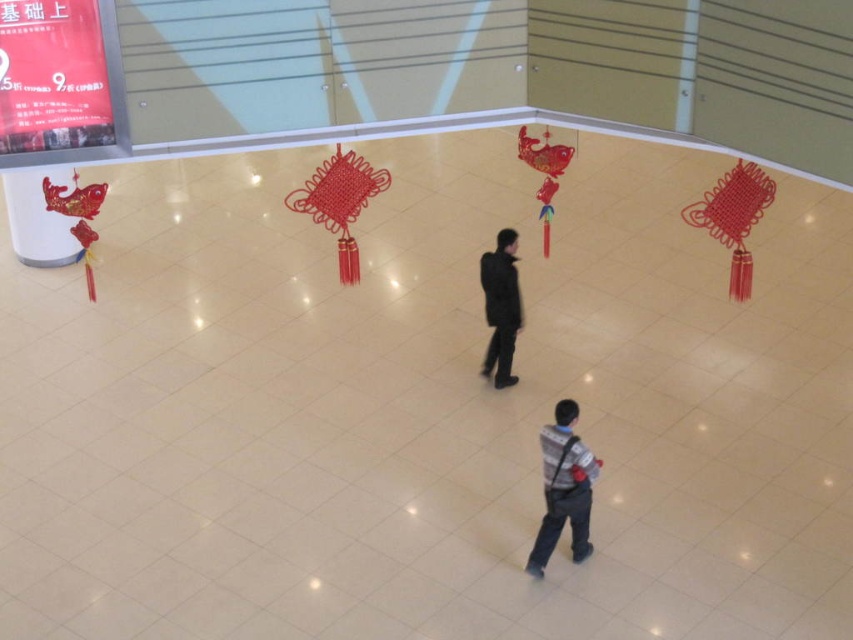
Question: Which point is closer to the camera?

Choices:
 (A) black matte jacket at center
 (B) striped sweater at lower right

Answer: (B)

Question: Which point is farther from the camera taking this photo?

Choices:
 (A) (561, 422)
 (B) (498, 264)

Answer: (B)

Question: Can you confirm if striped sweater at lower right is wider than black matte jacket at center?

Choices:
 (A) no
 (B) yes

Answer: (B)

Question: Is striped sweater at lower right wider than black matte jacket at center?

Choices:
 (A) no
 (B) yes

Answer: (B)

Question: Is striped sweater at lower right wider than black matte jacket at center?

Choices:
 (A) yes
 (B) no

Answer: (A)